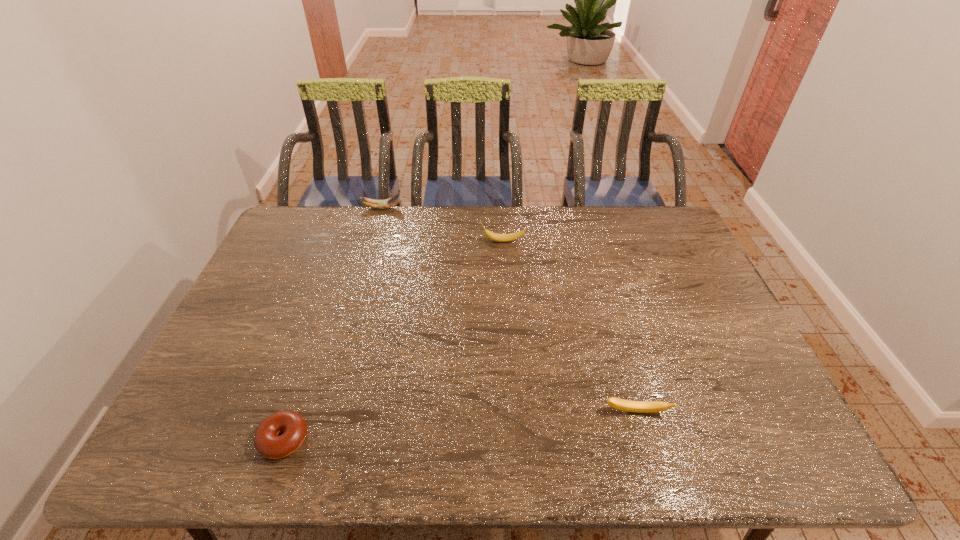
The height and width of the screenshot is (540, 960). In order to click on free space located 0.080m at the stem of the second tallest object in this screenshot , I will do point(456,241).

Locate an element on the screen. Image resolution: width=960 pixels, height=540 pixels. vacant space located at the stem of the shortest banana is located at coordinates (646, 447).

Find the location of a particular element. The width and height of the screenshot is (960, 540). vacant space located on the back of the shortest object is located at coordinates (300, 395).

I want to click on object positioned at the near edge, so click(267, 442).

This screenshot has width=960, height=540. What are the coordinates of `vacant space at the far edge` in the screenshot? It's located at (464, 220).

Where is `vacant space at the near edge of the desktop`? Image resolution: width=960 pixels, height=540 pixels. vacant space at the near edge of the desktop is located at coordinates (453, 437).

Image resolution: width=960 pixels, height=540 pixels. In the image, there is a desktop. Find the location of `vacant space at the left edge`. vacant space at the left edge is located at coordinates (292, 265).

Locate an element on the screen. This screenshot has height=540, width=960. vacant area at the right edge is located at coordinates (722, 354).

The width and height of the screenshot is (960, 540). In order to click on free spot at the far left corner of the desktop in this screenshot , I will do `click(286, 232)`.

In the image, there is a desktop. Where is `free space at the far right corner`? This screenshot has width=960, height=540. free space at the far right corner is located at coordinates (657, 215).